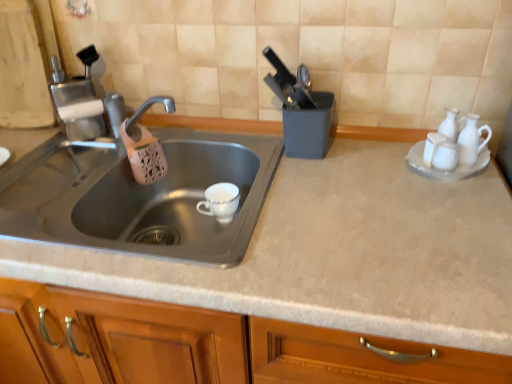
I want to click on free location in front of matte plastic knife block at upper right, so click(x=328, y=183).